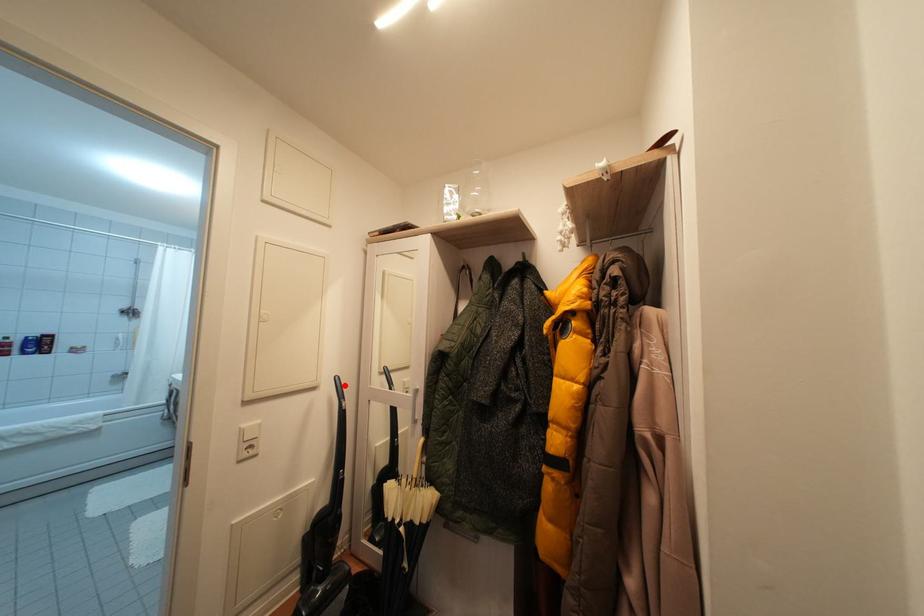
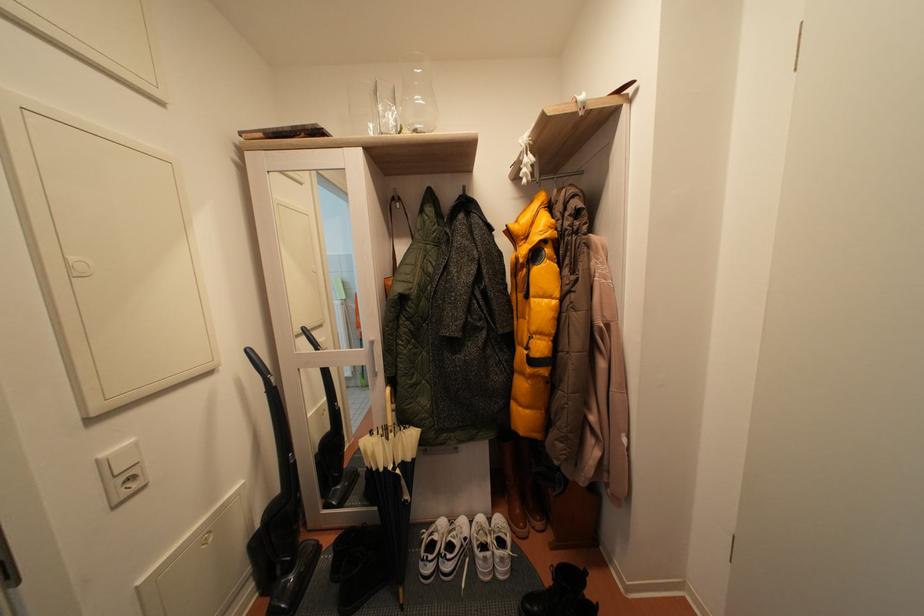
The point at the highlighted location is marked in the first image. Where is the corresponding point in the second image?

(257, 358)